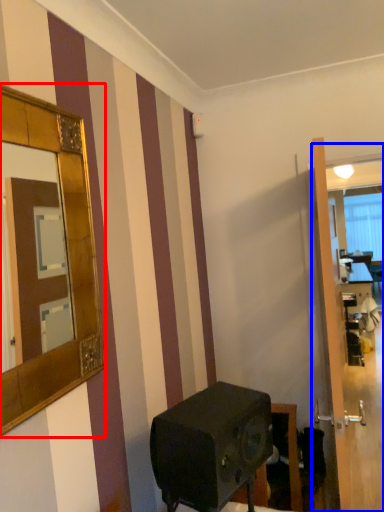
Question: Which object appears farthest to the camera in this image, mirror (highlighted by a red box) or glass door (highlighted by a blue box)?

Choices:
 (A) mirror
 (B) glass door

Answer: (B)